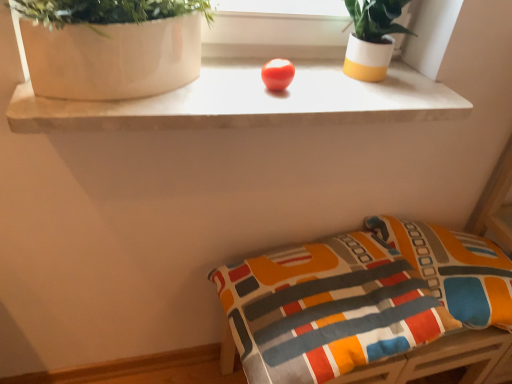
Question: Is white glossy vase at upper left thinner than textured fabric cushion at lower right?

Choices:
 (A) no
 (B) yes

Answer: (B)

Question: From a real-world perspective, is white glossy vase at upper left on textured fabric cushion at lower right?

Choices:
 (A) yes
 (B) no

Answer: (A)

Question: From a real-world perspective, is white glossy vase at upper left physically below textured fabric cushion at lower right?

Choices:
 (A) yes
 (B) no

Answer: (B)

Question: Can we say white glossy vase at upper left lies outside textured fabric cushion at lower right?

Choices:
 (A) no
 (B) yes

Answer: (B)

Question: Is white glossy vase at upper left far away from textured fabric cushion at lower right?

Choices:
 (A) yes
 (B) no

Answer: (B)

Question: Is white glossy vase at upper left shorter than textured fabric cushion at lower right?

Choices:
 (A) yes
 (B) no

Answer: (B)

Question: From a real-world perspective, is white glossy vase at upper left positioned over textured fabric pillow at lower right based on gravity?

Choices:
 (A) yes
 (B) no

Answer: (A)

Question: Is white glossy vase at upper left not within textured fabric pillow at lower right?

Choices:
 (A) yes
 (B) no

Answer: (A)

Question: Is white glossy vase at upper left not near textured fabric pillow at lower right?

Choices:
 (A) yes
 (B) no

Answer: (B)

Question: Considering the relative positions of white glossy vase at upper left and textured fabric pillow at lower right in the image provided, is white glossy vase at upper left to the left of textured fabric pillow at lower right from the viewer's perspective?

Choices:
 (A) no
 (B) yes

Answer: (B)

Question: Is white glossy vase at upper left wider than textured fabric pillow at lower right?

Choices:
 (A) no
 (B) yes

Answer: (A)

Question: Considering the relative sizes of white glossy vase at upper left and textured fabric pillow at lower right in the image provided, is white glossy vase at upper left thinner than textured fabric pillow at lower right?

Choices:
 (A) yes
 (B) no

Answer: (A)

Question: Can you confirm if white glossy vase at upper left is taller than white/yellow ceramic pot at upper right?

Choices:
 (A) yes
 (B) no

Answer: (B)